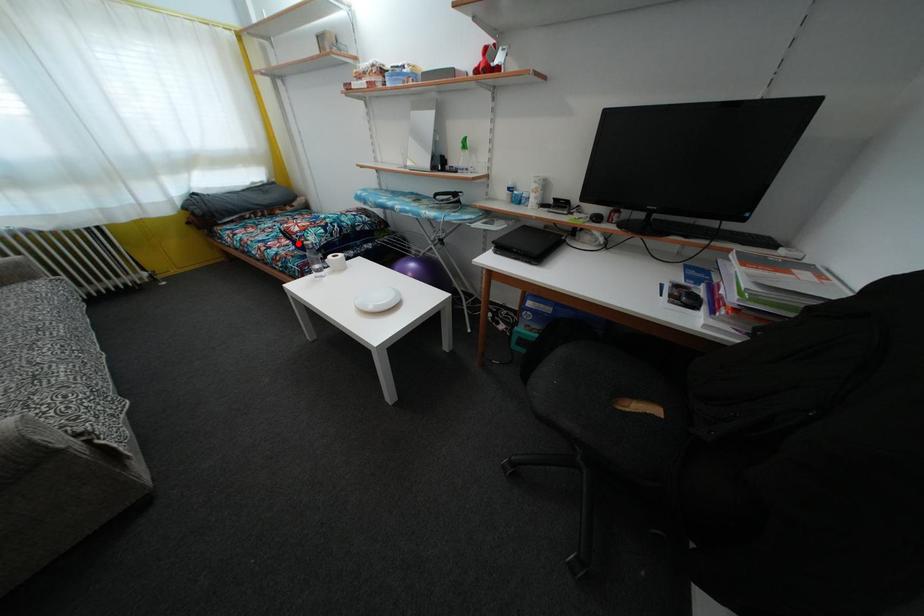
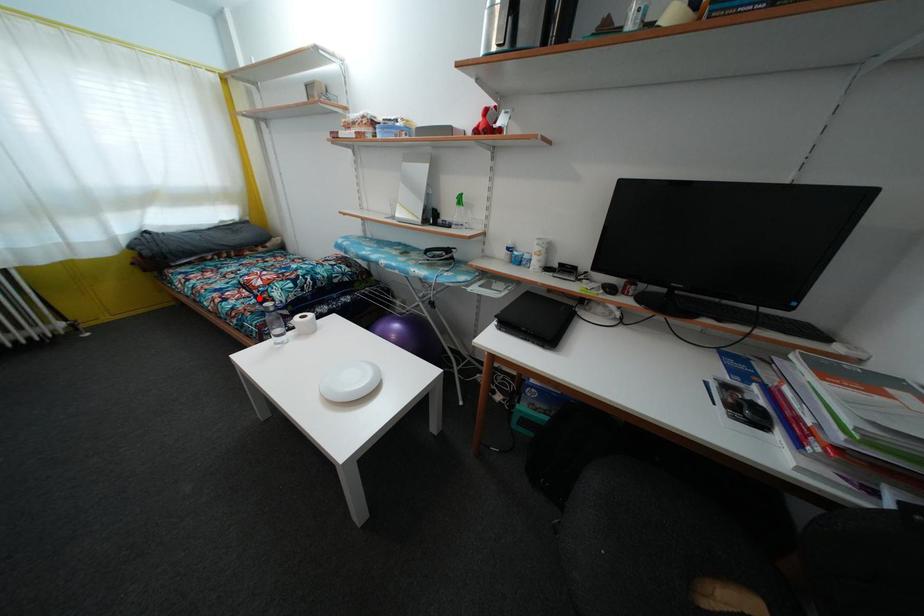
Consider the image. I am providing you with two images of the same scene from different viewpoints. A red point is marked on the first image and another point is marked on the second image. Are the points marked in image1 and image2 representing the same 3D position?

Yes